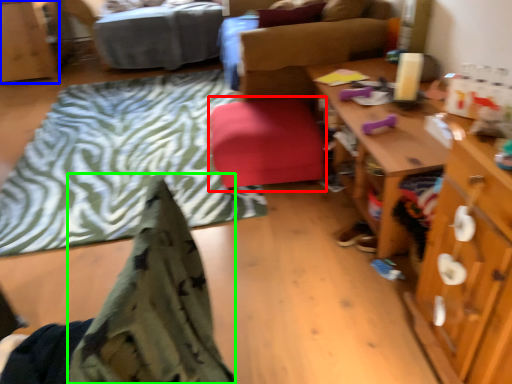
Question: Based on their relative distances, which object is nearer to stool (highlighted by a red box)? Choose from cabinetry (highlighted by a blue box) and blanket (highlighted by a green box).

Choices:
 (A) cabinetry
 (B) blanket

Answer: (B)